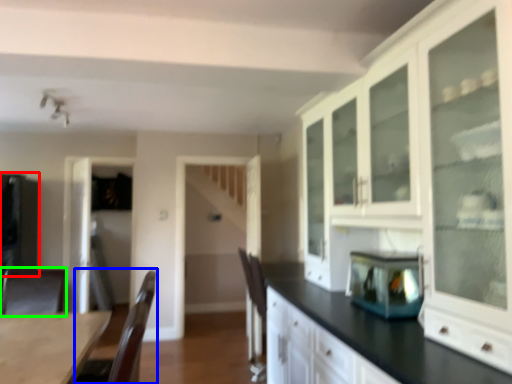
Question: Which is farther away from appliance (highlighted by a red box)? armchair (highlighted by a blue box) or armchair (highlighted by a green box)?

Choices:
 (A) armchair
 (B) armchair

Answer: (A)